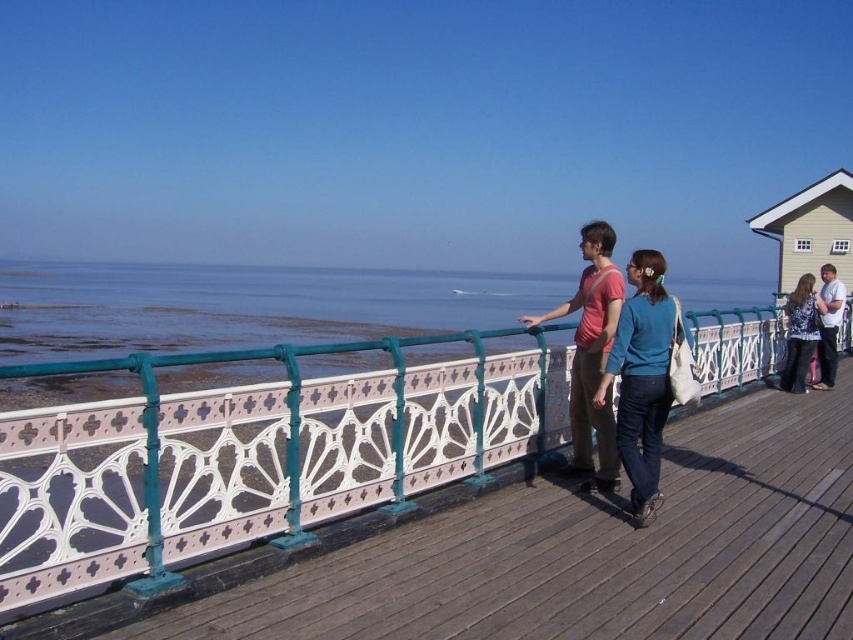
Question: Among these points, which one is farthest from the camera?

Choices:
 (A) (834, 324)
 (B) (144, 300)
 (C) (169, 461)

Answer: (B)

Question: Is clear blue water at upper left to the left of matte blue jeans at right from the viewer's perspective?

Choices:
 (A) yes
 (B) no

Answer: (A)

Question: Does teal fabric sweater at center come in front of light brown leather jacket at right?

Choices:
 (A) no
 (B) yes

Answer: (B)

Question: Considering the relative positions of matte pink shirt at center and light brown leather jacket at right in the image provided, where is matte pink shirt at center located with respect to light brown leather jacket at right?

Choices:
 (A) right
 (B) left

Answer: (B)

Question: Among these objects, which one is farthest from the camera?

Choices:
 (A) clear blue water at upper left
 (B) teal fabric sweater at center
 (C) white painted wood dock at center
 (D) matte blue jeans at right

Answer: (D)

Question: Which point is closer to the camera taking this photo?

Choices:
 (A) [844, 285]
 (B) [804, 308]
 (C) [598, 380]

Answer: (C)